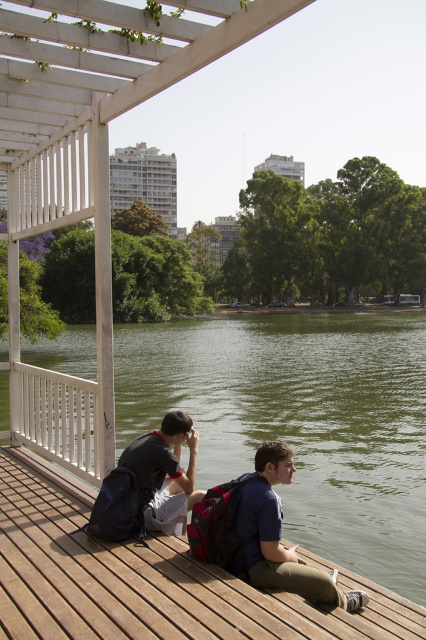
Question: Is blue fabric shirt at center to the right of dark gray backpack at lower left from the viewer's perspective?

Choices:
 (A) yes
 (B) no

Answer: (A)

Question: Which of the following is the farthest from the observer?

Choices:
 (A) dark gray backpack at lower left
 (B) blue fabric shirt at center
 (C) wooden at center

Answer: (A)

Question: Which object appears farthest from the camera in this image?

Choices:
 (A) blue fabric shirt at center
 (B) wooden at center

Answer: (A)

Question: Is the position of blue fabric shirt at center less distant than that of dark gray backpack at lower left?

Choices:
 (A) yes
 (B) no

Answer: (A)

Question: Does blue fabric shirt at center have a lesser width compared to dark gray backpack at lower left?

Choices:
 (A) yes
 (B) no

Answer: (B)

Question: Which point is closer to the camera?

Choices:
 (A) wooden at center
 (B) blue fabric shirt at center

Answer: (A)